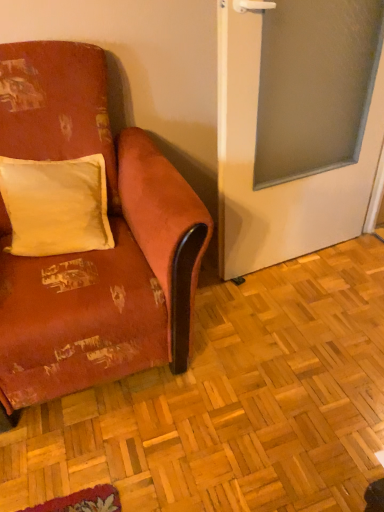
Question: Considering the relative positions of frosted glass screen door at right and velvet-like orange couch at left in the image provided, is frosted glass screen door at right to the left of velvet-like orange couch at left from the viewer's perspective?

Choices:
 (A) yes
 (B) no

Answer: (B)

Question: Does frosted glass screen door at right contain velvet-like orange couch at left?

Choices:
 (A) yes
 (B) no

Answer: (B)

Question: Is frosted glass screen door at right smaller than velvet-like orange couch at left?

Choices:
 (A) yes
 (B) no

Answer: (A)

Question: Can we say frosted glass screen door at right lies outside velvet-like orange couch at left?

Choices:
 (A) yes
 (B) no

Answer: (A)

Question: Does frosted glass screen door at right appear on the right side of velvet-like orange couch at left?

Choices:
 (A) yes
 (B) no

Answer: (A)

Question: From a real-world perspective, relative to frosted glass screen door at right, is velvet-like orange couch at left vertically above or below?

Choices:
 (A) above
 (B) below

Answer: (B)

Question: Is point (99, 291) closer or farther from the camera than point (233, 13)?

Choices:
 (A) farther
 (B) closer

Answer: (B)

Question: Is velvet-like orange couch at left spatially inside frosted glass screen door at right, or outside of it?

Choices:
 (A) outside
 (B) inside

Answer: (A)

Question: Would you say velvet-like orange couch at left is to the left or to the right of frosted glass screen door at right in the picture?

Choices:
 (A) right
 (B) left

Answer: (B)

Question: From the image's perspective, is velvet-like orange couch at left positioned above or below white soft cushion at upper left?

Choices:
 (A) above
 (B) below

Answer: (B)

Question: Is velvet-like orange couch at left inside the boundaries of white soft cushion at upper left, or outside?

Choices:
 (A) outside
 (B) inside

Answer: (A)

Question: Based on their sizes in the image, would you say velvet-like orange couch at left is bigger or smaller than white soft cushion at upper left?

Choices:
 (A) small
 (B) big

Answer: (B)

Question: From their relative heights in the image, would you say velvet-like orange couch at left is taller or shorter than white soft cushion at upper left?

Choices:
 (A) tall
 (B) short

Answer: (A)

Question: Is point (369, 186) positioned closer to the camera than point (94, 210)?

Choices:
 (A) farther
 (B) closer

Answer: (A)

Question: Is frosted glass screen door at right wider or thinner than white soft cushion at upper left?

Choices:
 (A) thin
 (B) wide

Answer: (A)